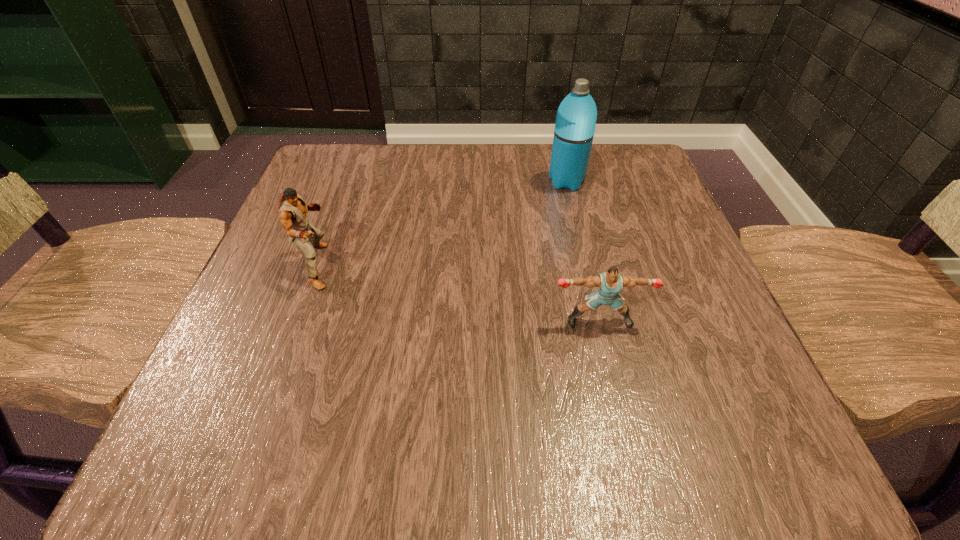
What are the coordinates of `free space at the far right corner` in the screenshot? It's located at (669, 202).

Identify the location of vacant area that lies between the nearest object and the farther puncher. (459, 294).

Identify the location of vacant area that lies between the second nearest object and the nearer puncher. The width and height of the screenshot is (960, 540). [x=459, y=294].

Where is `vacant point located between the tallest object and the second farthest object`? This screenshot has height=540, width=960. vacant point located between the tallest object and the second farthest object is located at coordinates (443, 224).

At what (x,y) coordinates should I click in order to perform the action: click on unoccupied position between the thermos bottle and the farther puncher. Please return your answer as a coordinate pair (x, y). This screenshot has height=540, width=960. Looking at the image, I should click on (x=443, y=224).

What are the coordinates of `free spot between the second tallest object and the nearest object` in the screenshot? It's located at (459, 294).

This screenshot has height=540, width=960. What are the coordinates of `free spot between the shortest object and the tallest object` in the screenshot? It's located at (583, 252).

You are a GUI agent. You are given a task and a screenshot of the screen. Output one action in this format:
    pyautogui.click(x=<x>, y=<y>)
    Task: Click on the vacant area that lies between the farthest object and the shortest object
    Image resolution: width=960 pixels, height=540 pixels.
    Given the screenshot: What is the action you would take?
    pyautogui.click(x=583, y=252)

Find the location of a particular element. The width and height of the screenshot is (960, 540). vacant space that's between the second farthest object and the shortest object is located at coordinates (459, 294).

What are the coordinates of `free space between the shorter puncher and the farthest object` in the screenshot? It's located at (583, 252).